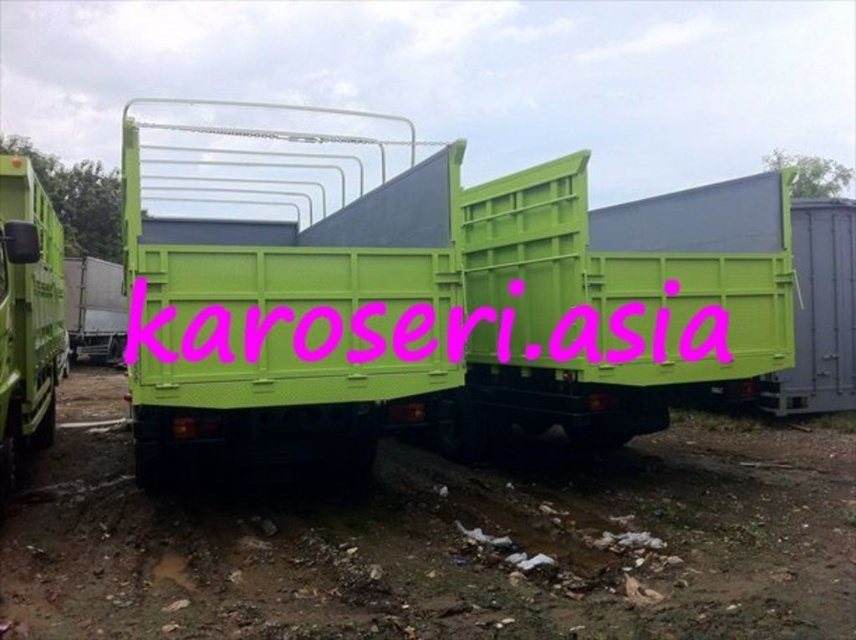
You are a delivery driver who needs to park your truck between the green matte truck at center and the matte green truck at left. Can you fit your truck if it is 3 meters tall?

The green matte truck at center is taller than the matte green truck at left. Since the height of the green matte truck at center is not specified, it is unclear whether your truck can fit between them. You may need to measure the available space first.

You are a delivery driver who needs to park your truck in a spot that is exactly at the center of the image. The current parking spot is occupied by the green matte truck at center. Can you move your truck to the desired spot without needing to adjust its position?

The green matte truck at center is already located at the center of the image at coordinates point (x=432, y=305), so you can simply move your truck to that spot without needing to adjust its position.